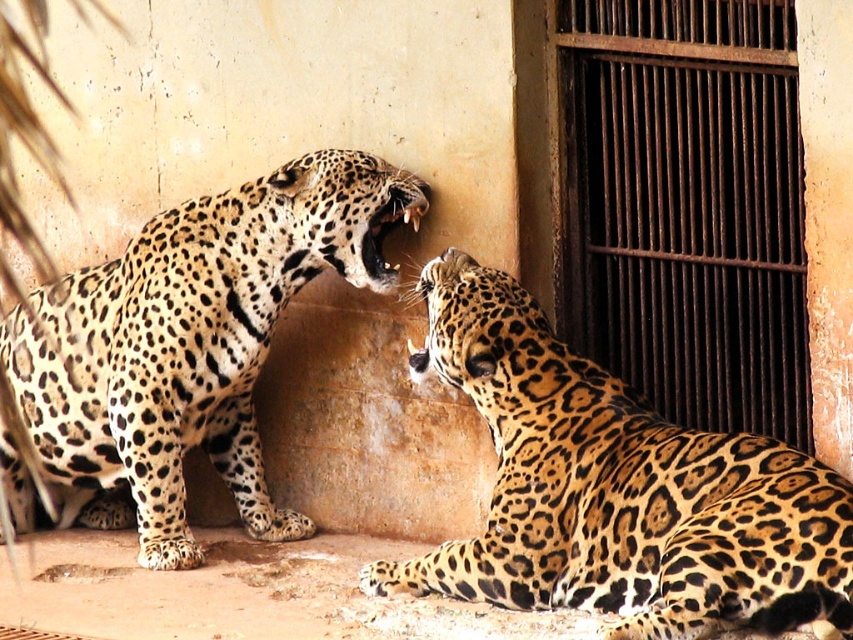
Does spotted fur leopard at lower right have a larger size compared to spotted fur jaguar at left?

Yes.

Which is above, spotted fur leopard at lower right or spotted fur jaguar at left?

spotted fur leopard at lower right is higher up.

What do you see at coordinates (618, 490) in the screenshot? The width and height of the screenshot is (853, 640). I see `spotted fur leopard at lower right` at bounding box center [618, 490].

Where is `spotted fur leopard at lower right`? This screenshot has width=853, height=640. spotted fur leopard at lower right is located at coordinates (618, 490).